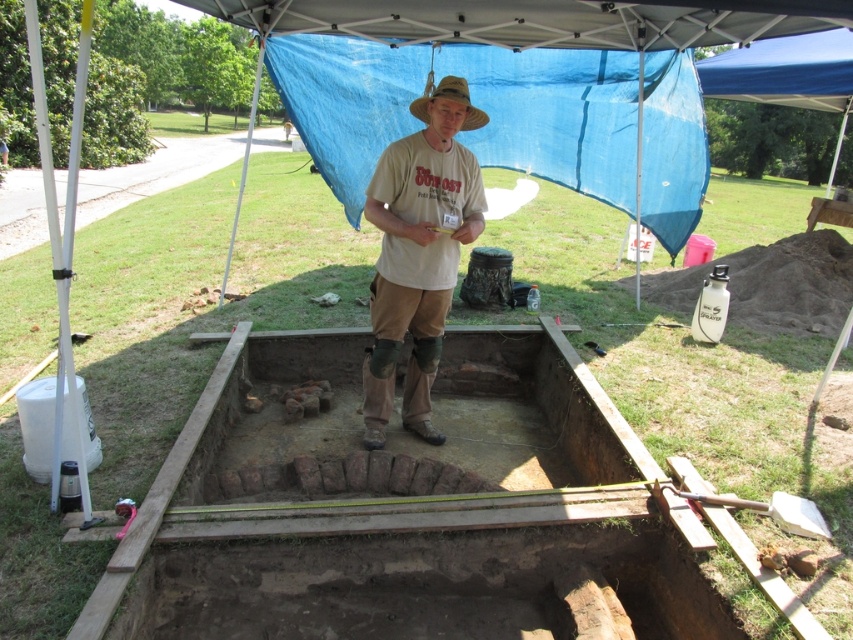
Question: From the image, what is the correct spatial relationship of brown clay foundation at center in relation to brown straw hat at center?

Choices:
 (A) below
 (B) above

Answer: (A)

Question: Which point is farther to the camera?

Choices:
 (A) (407, 220)
 (B) (372, 532)

Answer: (A)

Question: Is beige cotton shirt at center to the left of brown straw hat at center from the viewer's perspective?

Choices:
 (A) no
 (B) yes

Answer: (B)

Question: Can you confirm if brown clay foundation at center is wider than brown straw hat at center?

Choices:
 (A) yes
 (B) no

Answer: (A)

Question: Which object is the farthest from the beige cotton shirt at center?

Choices:
 (A) brown straw hat at center
 (B) brown clay foundation at center

Answer: (B)

Question: Which of these objects is positioned farthest from the brown straw hat at center?

Choices:
 (A) brown clay foundation at center
 (B) beige cotton shirt at center

Answer: (A)